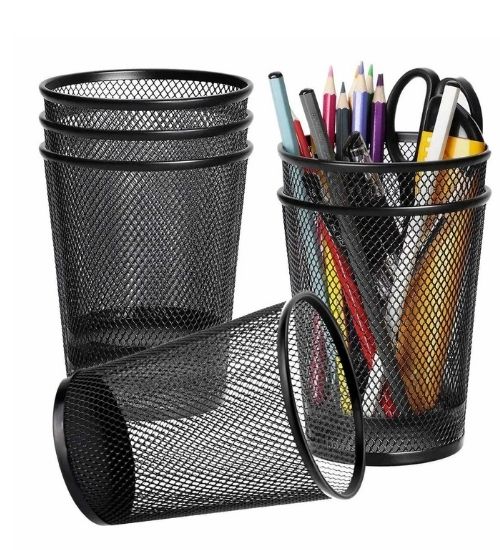
Locate an element on the screen. pencil holder cups is located at coordinates (123, 104), (132, 132), (135, 165), (289, 390), (382, 170), (382, 205).